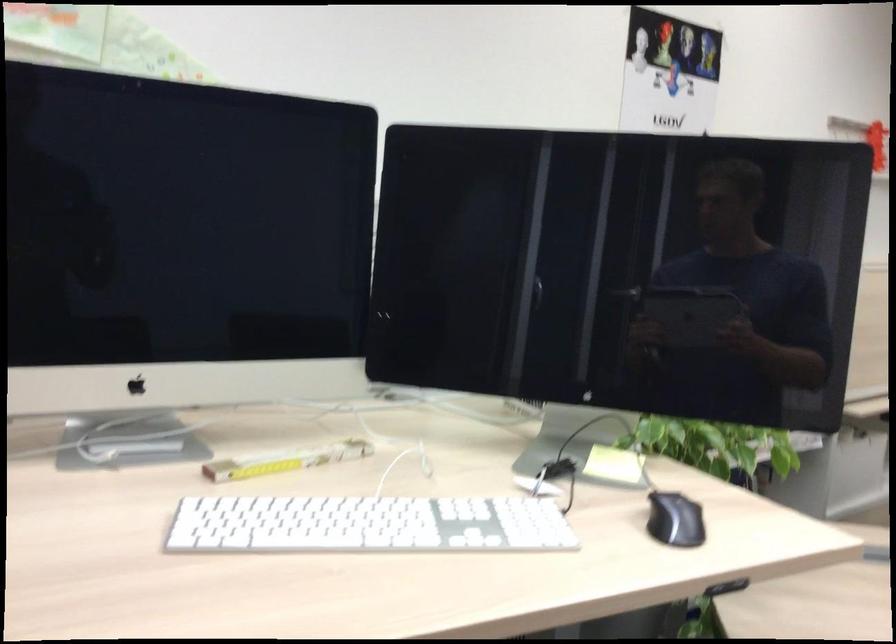
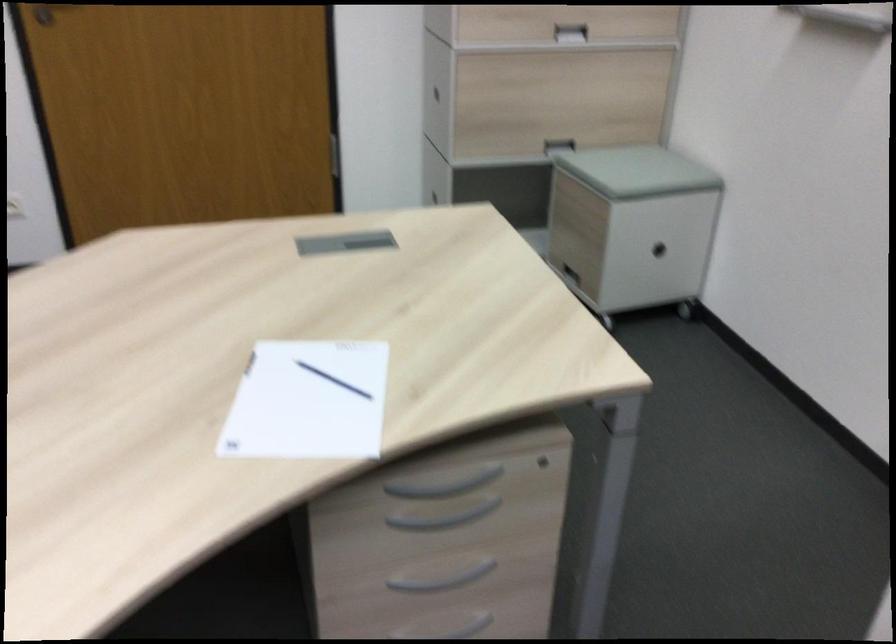
The images are taken continuously from a first-person perspective. In which direction is your viewpoint rotating?

The camera's rotation is toward right-down.